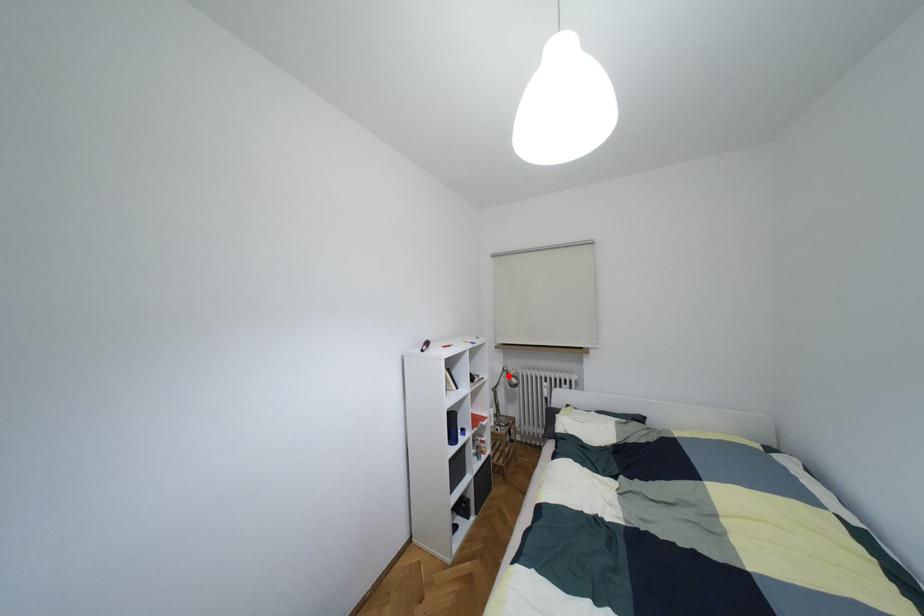
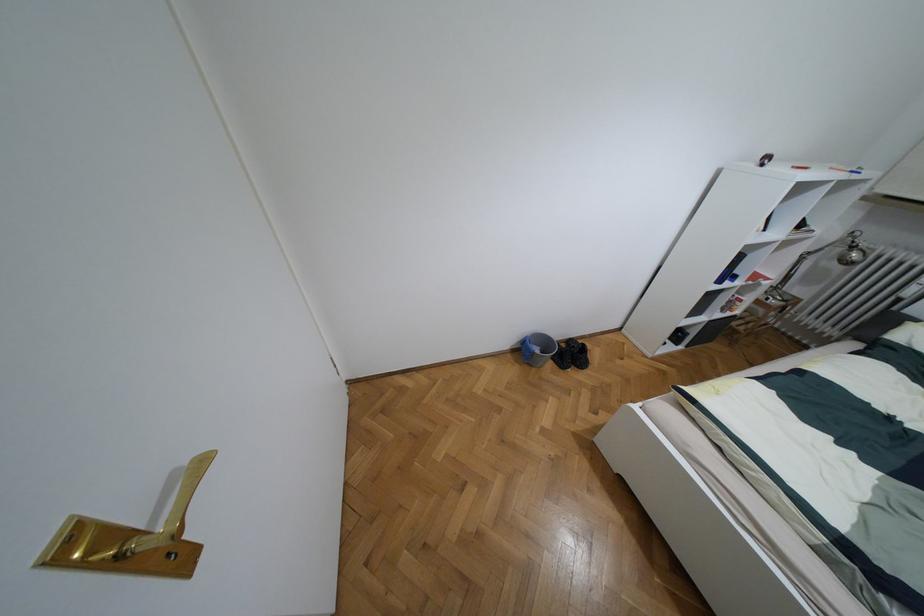
Find the pixel in the second image that matches the highlighted location in the first image.

(852, 246)